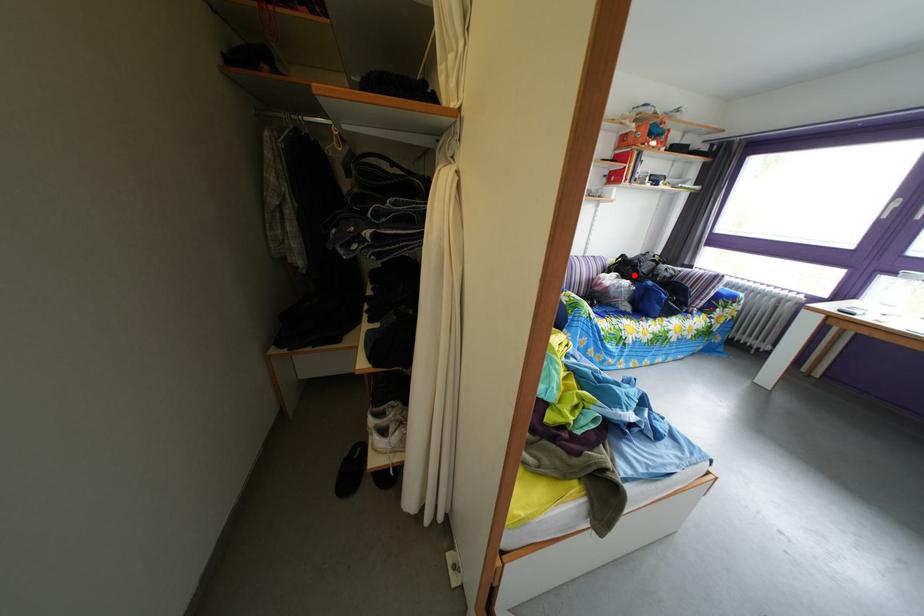
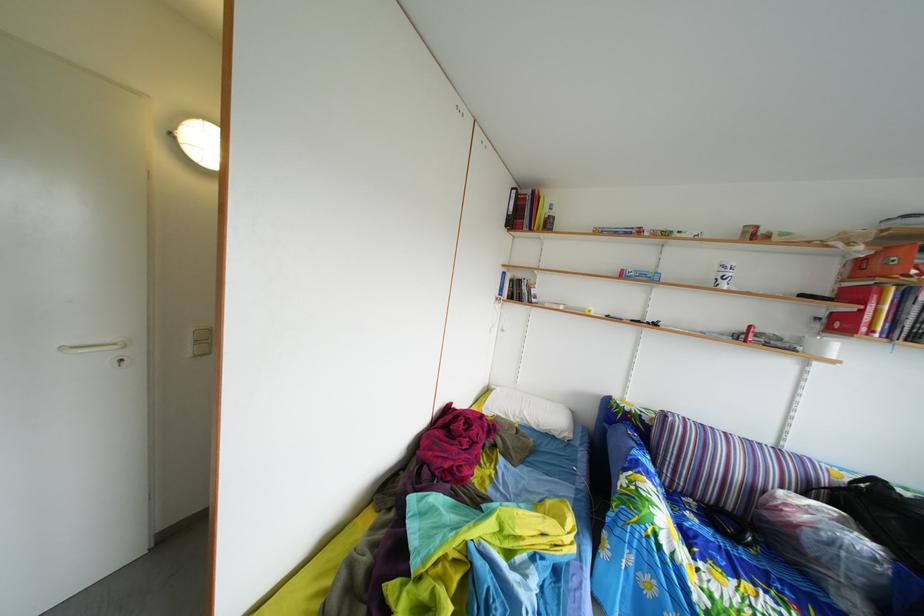
In the second image, find the point that corresponds to the highlighted location in the first image.

(886, 515)